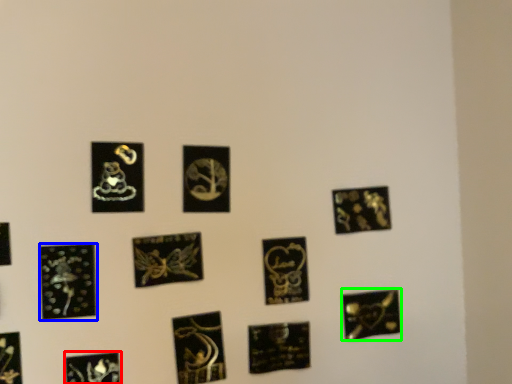
Question: Which object is positioned farthest from picture frame (highlighted by a red box)? Select from picture frame (highlighted by a blue box) and picture frame (highlighted by a green box).

Choices:
 (A) picture frame
 (B) picture frame

Answer: (B)